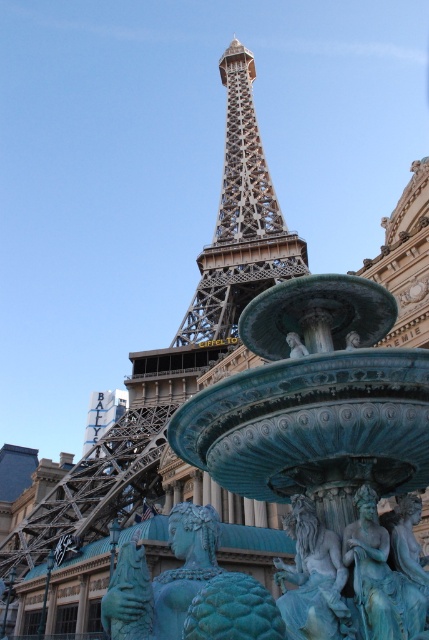
You are standing in front of the Eiffel Tower replica at Paris Las Vegas. You see two points marked on the image, one at point coordinates point (220, 68) and the other at point coordinates point (413, 520). Which point is closer to you?

Point (220, 68) is further to the camera than point (413, 520), so the point closer to you is point (413, 520).

You are a tourist standing in front of the Paris Las Vegas hotel. You notice both the metallic brown eiffel tower at center and the teal stone lion at center. Which object would appear larger to you?

The metallic brown eiffel tower at center is bigger than the teal stone lion at center, so it would appear larger to you.

You are a tour guide at the Paris Las Vegas hotel. A visitor asks if they can walk from the metallic brown eiffel tower at center to the green patina statue at center in under 2 minutes. Assuming a walking speed of 1.4 meters per second, can they make it?

The distance between the metallic brown eiffel tower at center and the green patina statue at center is 78.55 meters. At a walking speed of 1.4 meters per second, it would take approximately 56 seconds to cover the distance. Since 56 seconds is less than 2 minutes, the visitor can walk from the metallic brown eiffel tower at center to the green patina statue at center in under 2 minutes.